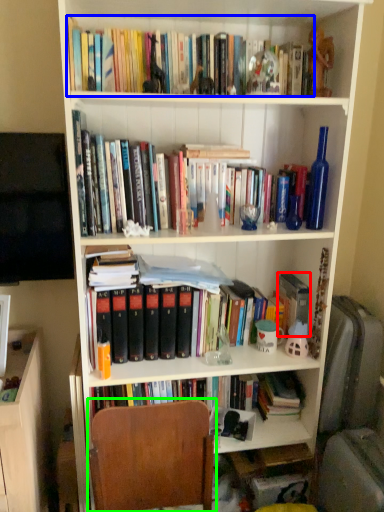
Question: Estimate the real-world distances between objects in this image. Which object is farther from paperback book (highlighted by a red box), book (highlighted by a blue box) or chair (highlighted by a green box)?

Choices:
 (A) book
 (B) chair

Answer: (A)